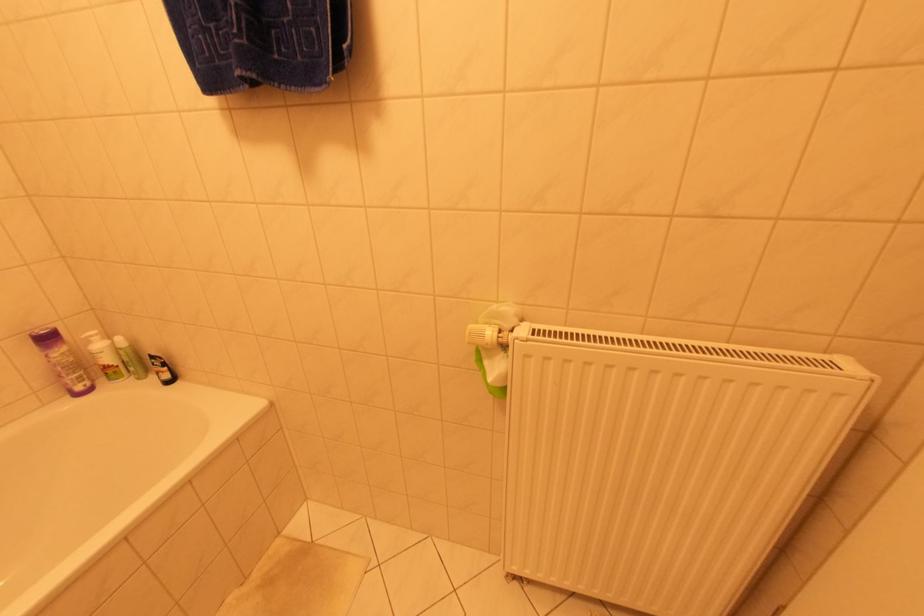
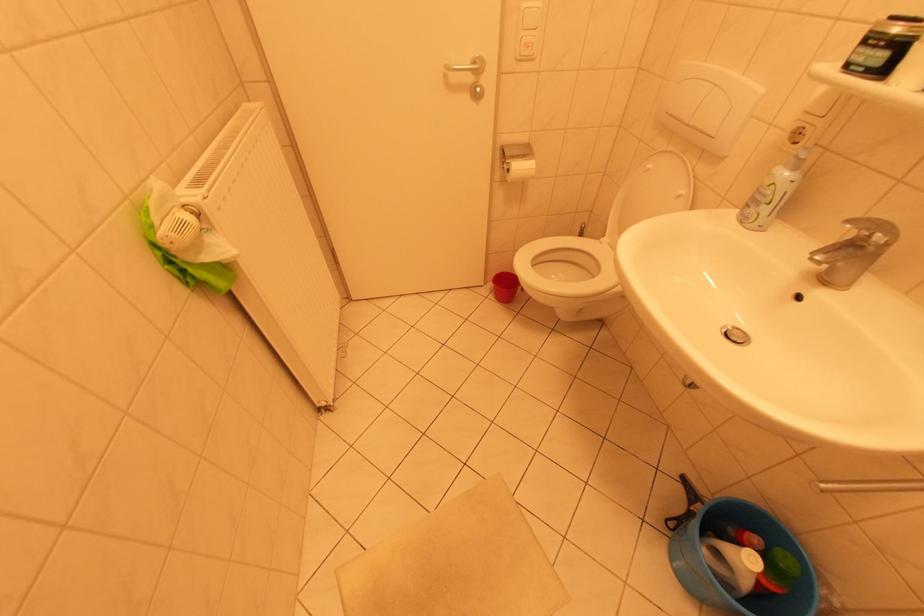
Based on the continuous images, in which direction is the camera rotating?

The camera's rotation is toward right-down.